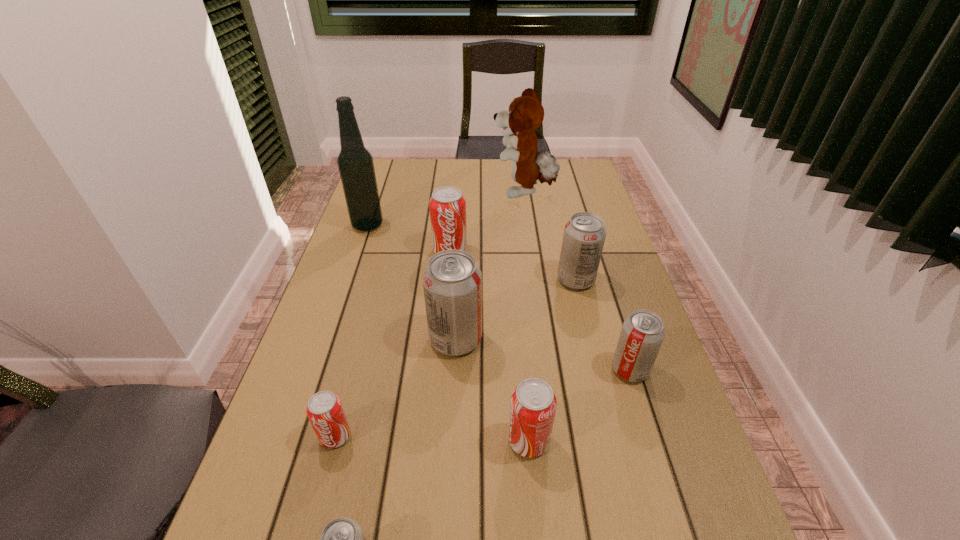
The height and width of the screenshot is (540, 960). Find the location of `vacant space that satisfies the following two spatial constraints: 1. on the face of the farthest object; 2. on the right side of the third biggest gray soda can`. vacant space that satisfies the following two spatial constraints: 1. on the face of the farthest object; 2. on the right side of the third biggest gray soda can is located at coordinates point(549,369).

Image resolution: width=960 pixels, height=540 pixels. In order to click on free space in the image that satisfies the following two spatial constraints: 1. on the back side of the fourth farthest object; 2. on the left side of the third gray soda can from right to left in this screenshot , I will do `click(459, 280)`.

The image size is (960, 540). Find the location of `vacant area in the image that satisfies the following two spatial constraints: 1. on the logo side of the farthest gray soda can; 2. on the left side of the farthest soda can`. vacant area in the image that satisfies the following two spatial constraints: 1. on the logo side of the farthest gray soda can; 2. on the left side of the farthest soda can is located at coordinates (447, 280).